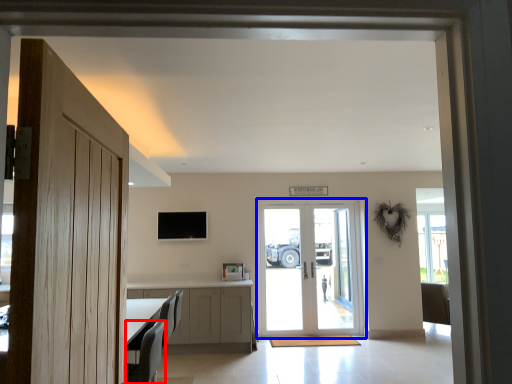
Question: Among these objects, which one is nearest to the camera, armchair (highlighted by a red box) or door (highlighted by a blue box)?

Choices:
 (A) armchair
 (B) door

Answer: (A)